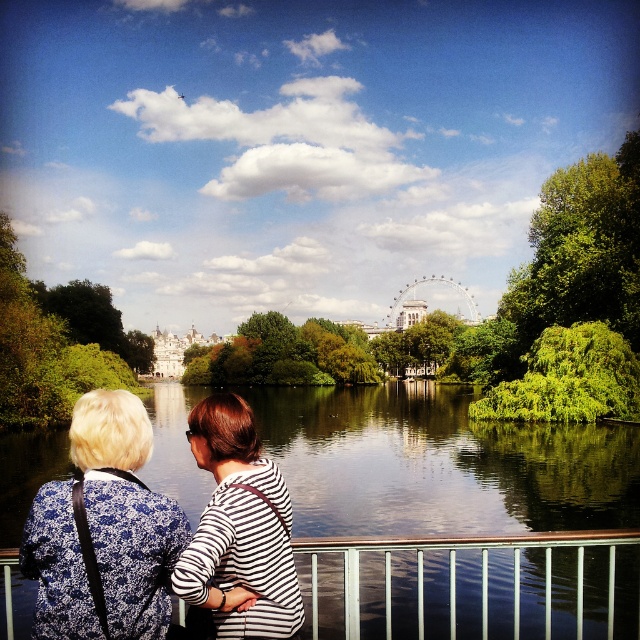
Question: Among these objects, which one is nearest to the camera?

Choices:
 (A) blue floral blouse at upper left
 (B) transparent glass water at center
 (C) white metal balustrade at center
 (D) striped fabric at center

Answer: (A)

Question: Among these objects, which one is nearest to the camera?

Choices:
 (A) striped fabric at center
 (B) white metal balustrade at center
 (C) transparent glass water at center
 (D) blue floral blouse at upper left

Answer: (D)

Question: Is white metal balustrade at center wider than blue floral blouse at upper left?

Choices:
 (A) no
 (B) yes

Answer: (B)

Question: Does white metal balustrade at center have a lesser width compared to blue floral blouse at upper left?

Choices:
 (A) no
 (B) yes

Answer: (A)

Question: Is transparent glass water at center above striped fabric at center?

Choices:
 (A) no
 (B) yes

Answer: (B)

Question: Which of the following is the closest to the observer?

Choices:
 (A) striped fabric at center
 (B) transparent glass water at center
 (C) blue floral blouse at upper left
 (D) white metal balustrade at center

Answer: (C)